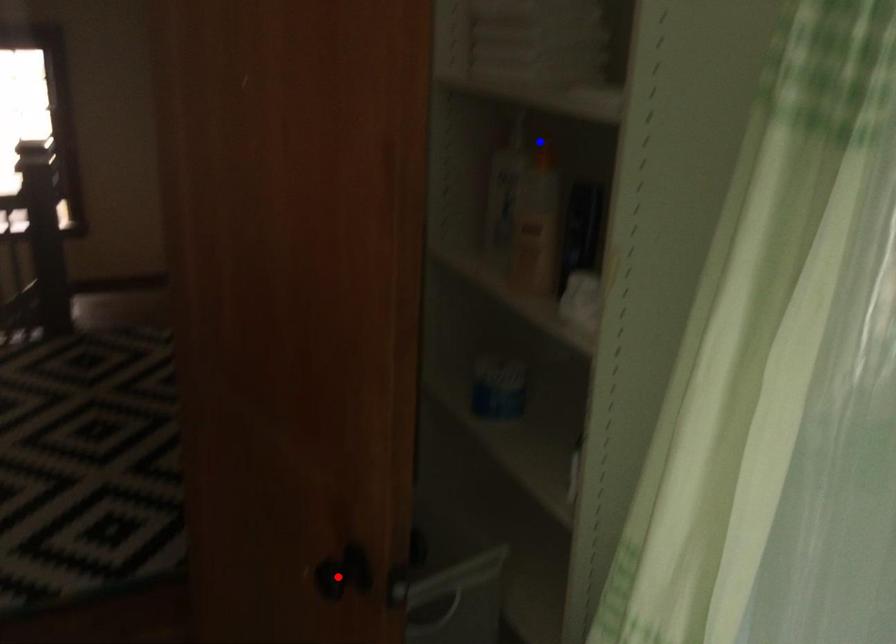
Question: In the image, two points are highlighted. Which point is nearer to the camera? Reply with the corresponding letter.

Choices:
 (A) blue point
 (B) red point

Answer: (B)